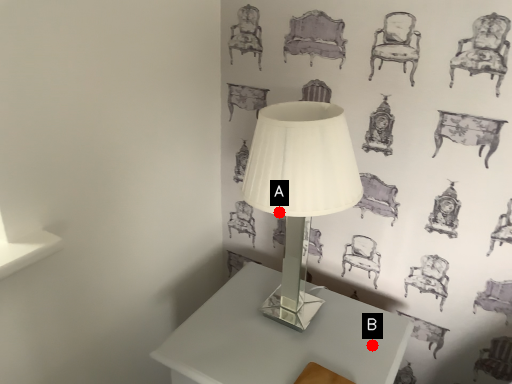
Question: Two points are circled on the image, labeled by A and B beside each circle. Which point is closer to the camera?

Choices:
 (A) A is closer
 (B) B is closer

Answer: (A)